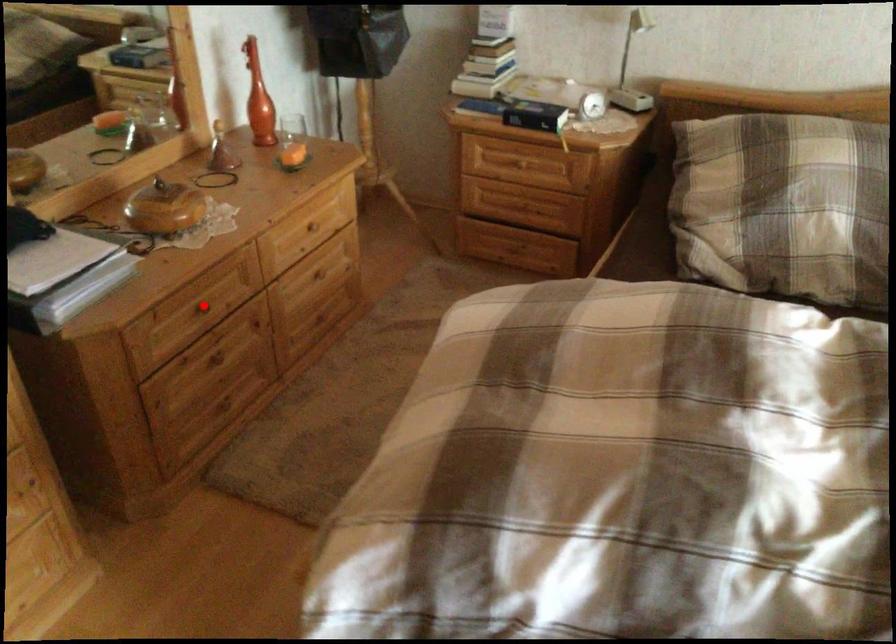
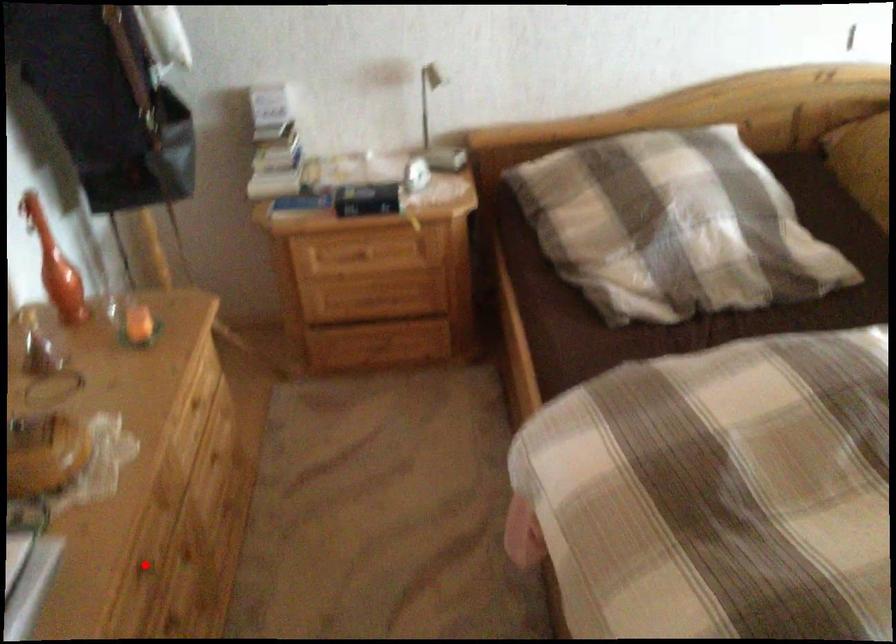
I am providing you with two images of the same scene from different viewpoints. A red point is marked on the first image and another point is marked on the second image. Are the points marked in image1 and image2 representing the same 3D position?

Yes